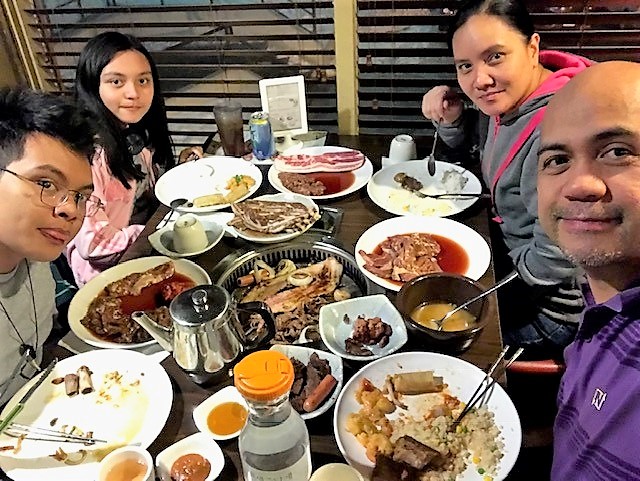
Identify the location of blinds. The image size is (640, 481). (285, 4), (374, 3).